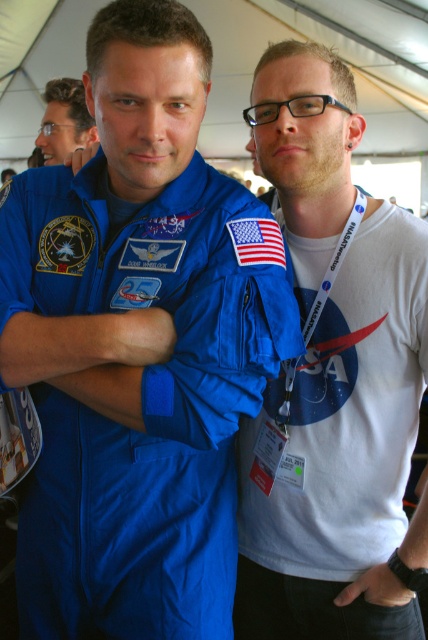
Question: Which point is closer to the camera?

Choices:
 (A) (401, 248)
 (B) (70, 131)

Answer: (A)

Question: Can you confirm if matte blue jumpsuit at left is positioned to the left of blue fabric astronaut suit at center?

Choices:
 (A) no
 (B) yes

Answer: (B)

Question: Does matte blue jumpsuit at left have a larger size compared to blue fabric astronaut suit at center?

Choices:
 (A) no
 (B) yes

Answer: (B)

Question: Does matte blue jumpsuit at left appear on the right side of matte black hair at upper left?

Choices:
 (A) no
 (B) yes

Answer: (B)

Question: Which point is farther from the camera taking this photo?

Choices:
 (A) (68, 204)
 (B) (336, 472)

Answer: (B)

Question: Which object appears closest to the camera in this image?

Choices:
 (A) matte blue jumpsuit at left
 (B) matte black hair at upper left
 (C) blue fabric astronaut suit at center

Answer: (A)